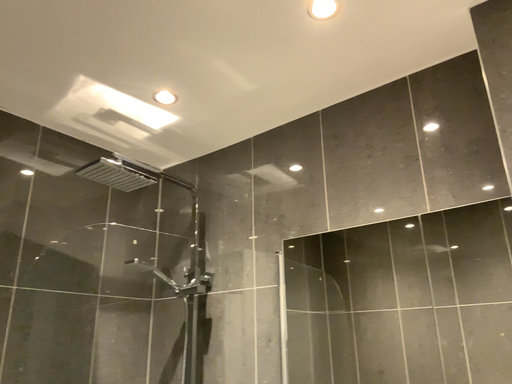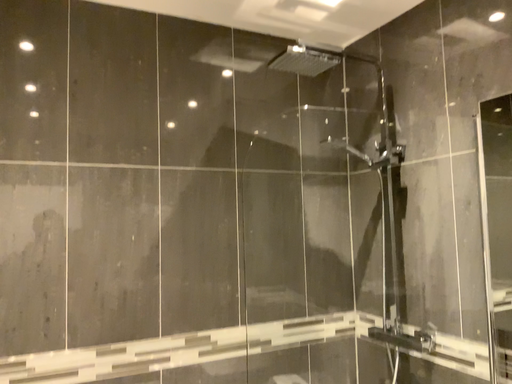
Question: Which way did the camera rotate in the video?

Choices:
 (A) rotated right
 (B) rotated left

Answer: (B)